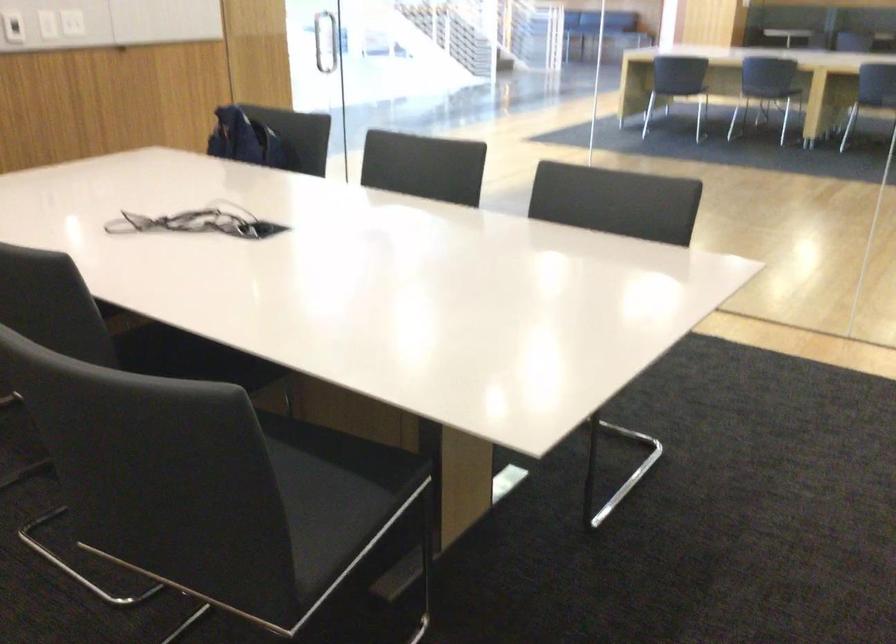
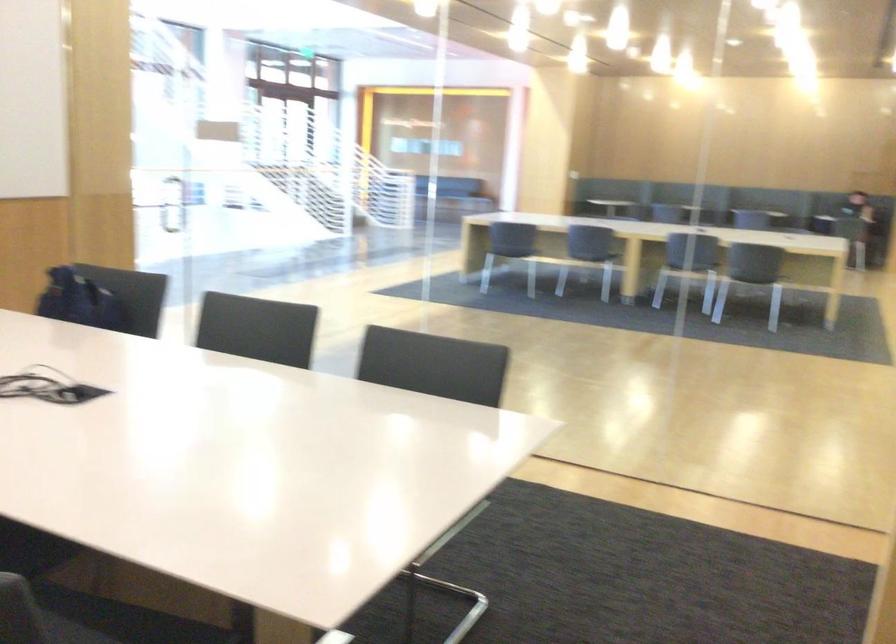
What movement of the cameraman would produce the second image?

The movement direction of the cameraman is right, backward.